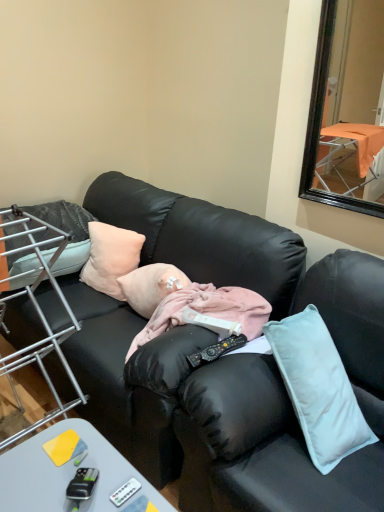
What is the approximate width of soft pink pillow at left, arranged as the first pillow when viewed from the left?

soft pink pillow at left, arranged as the first pillow when viewed from the left, is 55.47 centimeters in width.

What do you see at coordinates (67, 232) in the screenshot?
I see `soft pink pillow at left, arranged as the first pillow when viewed from the left` at bounding box center [67, 232].

This screenshot has height=512, width=384. In order to click on pink fabric at center, the first person when ordered from back to front in this screenshot , I will do (x=151, y=286).

What do you see at coordinates (216, 350) in the screenshot?
I see `black plastic remote control at center, marked as the 2th remote control in a left-to-right arrangement` at bounding box center [216, 350].

Find the location of a particular element. The width and height of the screenshot is (384, 512). white plastic remote control at lower center, the 1th remote control when ordered from bottom to top is located at coordinates (125, 492).

Identify the location of peach fabric pillow at center, which appears as the 2th pillow when viewed from the left. Image resolution: width=384 pixels, height=512 pixels. (111, 257).

This screenshot has height=512, width=384. I want to click on black leather couch at center, so click(x=226, y=359).

From a real-world perspective, does peach fabric pillow at center, which appears as the 1th pillow when viewed from the right, sit lower than black leather couch at center?

No.

Is peach fabric pillow at center, which appears as the 1th pillow when viewed from the right, to the left of black leather couch at center from the viewer's perspective?

Indeed, peach fabric pillow at center, which appears as the 1th pillow when viewed from the right, is positioned on the left side of black leather couch at center.

Which is nearer, (93, 262) or (99, 408)?

Point (93, 262) is positioned farther from the camera compared to point (99, 408).

Is pink fabric at center, arranged as the second person when viewed from the front, positioned in front of pink fabric at center, arranged as the first person when viewed from the front?

No.

From the image's perspective, which one is positioned higher, pink fabric at center, the first person when ordered from back to front, or pink fabric at center, arranged as the first person when viewed from the front?

pink fabric at center, the first person when ordered from back to front, from the image's perspective.

Looking at this image, who is smaller, pink fabric at center, the first person when ordered from back to front, or pink fabric at center, positioned as the 2th person in back-to-front order?

pink fabric at center, the first person when ordered from back to front, is smaller.

Is pink fabric at center, the first person when ordered from back to front, to the right of pink fabric at center, positioned as the 2th person in back-to-front order, from the viewer's perspective?

In fact, pink fabric at center, the first person when ordered from back to front, is to the left of pink fabric at center, positioned as the 2th person in back-to-front order.

Would you say pink fabric at center, arranged as the first person when viewed from the front, is inside or outside black leather couch at center?

pink fabric at center, arranged as the first person when viewed from the front, exists entirely within black leather couch at center.

You are a GUI agent. You are given a task and a screenshot of the screen. Output one action in this format:
    pyautogui.click(x=<x>, y=<y>)
    Task: Click on the studio couch in front of the pink fabric at center, arranged as the first person when viewed from the front
    The height and width of the screenshot is (512, 384).
    Given the screenshot: What is the action you would take?
    pyautogui.click(x=226, y=359)

Considering the relative sizes of pink fabric at center, positioned as the 2th person in back-to-front order, and black leather couch at center in the image provided, is pink fabric at center, positioned as the 2th person in back-to-front order, wider than black leather couch at center?

No.

From a real-world perspective, between pink fabric at center, arranged as the first person when viewed from the front, and black leather couch at center, who is vertically higher?

In real-world perspective, pink fabric at center, arranged as the first person when viewed from the front, is above.

From their relative heights in the image, would you say pink fabric at center, arranged as the second person when viewed from the front, is taller or shorter than peach fabric pillow at center, which appears as the 2th pillow when viewed from the left?

In the image, pink fabric at center, arranged as the second person when viewed from the front, appears to be shorter than peach fabric pillow at center, which appears as the 2th pillow when viewed from the left.

Is pink fabric at center, the first person when ordered from back to front, to the left or to the right of peach fabric pillow at center, which appears as the 1th pillow when viewed from the right, in the image?

Based on their positions, pink fabric at center, the first person when ordered from back to front, is located to the right of peach fabric pillow at center, which appears as the 1th pillow when viewed from the right.

Does pink fabric at center, the first person when ordered from back to front, turn towards peach fabric pillow at center, which appears as the 1th pillow when viewed from the right?

No, pink fabric at center, the first person when ordered from back to front, is not facing towards peach fabric pillow at center, which appears as the 1th pillow when viewed from the right.

Is pink fabric at center, arranged as the second person when viewed from the front, further to camera compared to peach fabric pillow at center, which appears as the 2th pillow when viewed from the left?

No.

Would you say soft pink pillow at left, arranged as the first pillow when viewed from the left, contains metal wire rack at left?

No, metal wire rack at left is not inside soft pink pillow at left, arranged as the first pillow when viewed from the left.

Is soft pink pillow at left, arranged as the first pillow when viewed from the left, to the right of metal wire rack at left from the viewer's perspective?

Incorrect, soft pink pillow at left, arranged as the first pillow when viewed from the left, is not on the right side of metal wire rack at left.

Considering the sizes of objects soft pink pillow at left, the 2th pillow from the right, and metal wire rack at left in the image provided, who is smaller, soft pink pillow at left, the 2th pillow from the right, or metal wire rack at left?

Smaller between the two is metal wire rack at left.

Is soft pink pillow at left, arranged as the first pillow when viewed from the left, aimed at metal wire rack at left?

No, soft pink pillow at left, arranged as the first pillow when viewed from the left, does not turn towards metal wire rack at left.

Measure the distance from soft pink pillow at left, the 2th pillow from the right, to black leather couch at center.

A distance of 22.02 inches exists between soft pink pillow at left, the 2th pillow from the right, and black leather couch at center.

From the image's perspective, who appears lower, soft pink pillow at left, the 2th pillow from the right, or black leather couch at center?

From the image's view, black leather couch at center is below.

Consider the image. From a real-world perspective, is soft pink pillow at left, arranged as the first pillow when viewed from the left, above or below black leather couch at center?

soft pink pillow at left, arranged as the first pillow when viewed from the left, is above black leather couch at center.

Is soft pink pillow at left, the 2th pillow from the right, bigger or smaller than black leather couch at center?

Considering their sizes, soft pink pillow at left, the 2th pillow from the right, takes up less space than black leather couch at center.

Does point (77, 241) appear closer or farther from the camera than point (132, 290)?

Clearly, point (77, 241) is more distant from the camera than point (132, 290).

From a real-world perspective, is soft pink pillow at left, the 2th pillow from the right, located beneath pink fabric at center, the first person when ordered from back to front?

Actually, soft pink pillow at left, the 2th pillow from the right, is physically above pink fabric at center, the first person when ordered from back to front, in the real world.

Can pink fabric at center, the first person when ordered from back to front, be found inside soft pink pillow at left, arranged as the first pillow when viewed from the left?

No.

Does soft pink pillow at left, the 2th pillow from the right, lie behind pink fabric at center, arranged as the second person when viewed from the front?

Yes, it is behind pink fabric at center, arranged as the second person when viewed from the front.

Locate an element on the screen. The height and width of the screenshot is (512, 384). studio couch that appears below the peach fabric pillow at center, which appears as the 2th pillow when viewed from the left (from a real-world perspective) is located at coordinates (226, 359).

Find the location of `person above the pink fabric at center, positioned as the 2th person in back-to-front order (from the image's perspective)`. person above the pink fabric at center, positioned as the 2th person in back-to-front order (from the image's perspective) is located at coordinates (151, 286).

Which object lies further to the anchor point peach fabric pillow at center, which appears as the 1th pillow when viewed from the right, pink fabric at center, arranged as the first person when viewed from the front, or metal wire rack at left?

metal wire rack at left.

Based on their spatial positions, is pink fabric at center, positioned as the 2th person in back-to-front order, or metal wire rack at left further from soft pink pillow at left, the 2th pillow from the right?

pink fabric at center, positioned as the 2th person in back-to-front order.

From the image, which object appears to be farther from white plastic remote control at lower center, the 1th remote control from the left, metal wire rack at left or peach fabric pillow at center, which appears as the 1th pillow when viewed from the right?

Among the two, peach fabric pillow at center, which appears as the 1th pillow when viewed from the right, is located further to white plastic remote control at lower center, the 1th remote control from the left.

From the image, which object appears to be nearer to black plastic remote control at center, which is the first remote control from right to left, pink fabric at center, the first person when ordered from back to front, or black leather couch at center?

black leather couch at center.

Considering their positions, is pink fabric at center, the first person when ordered from back to front, positioned closer to white plastic remote control at lower center, the second remote control positioned from the top, than metal wire rack at left?

pink fabric at center, the first person when ordered from back to front.

Which object lies further to the anchor point soft pink pillow at left, arranged as the first pillow when viewed from the left, black plastic remote control at center, the 1th remote control positioned from the back, or metal wire rack at left?

Among the two, black plastic remote control at center, the 1th remote control positioned from the back, is located further to soft pink pillow at left, arranged as the first pillow when viewed from the left.

Considering their positions, is pink fabric at center, arranged as the second person when viewed from the front, positioned further to pink fabric at center, positioned as the 2th person in back-to-front order, than soft pink pillow at left, the 2th pillow from the right?

soft pink pillow at left, the 2th pillow from the right, lies further to pink fabric at center, positioned as the 2th person in back-to-front order, than the other object.

Based on the photo, looking at the image, which one is located closer to black leather couch at center, gray plastic desk at lower left or metal wire rack at left?

The object closer to black leather couch at center is metal wire rack at left.

Where is `person between soft pink pillow at left, arranged as the first pillow when viewed from the left, and pink fabric at center, positioned as the 2th person in back-to-front order, in the horizontal direction`? This screenshot has height=512, width=384. person between soft pink pillow at left, arranged as the first pillow when viewed from the left, and pink fabric at center, positioned as the 2th person in back-to-front order, in the horizontal direction is located at coordinates (151, 286).

At what (x,y) coordinates should I click in order to perform the action: click on remote control between black leather couch at center and peach fabric pillow at center, which appears as the 2th pillow when viewed from the left, along the z-axis. Please return your answer as a coordinate pair (x, y). The image size is (384, 512). Looking at the image, I should click on (216, 350).

Image resolution: width=384 pixels, height=512 pixels. Identify the location of remote control between pink fabric at center, positioned as the 2th person in back-to-front order, and peach fabric pillow at center, which appears as the 1th pillow when viewed from the right, in the front-back direction. (216, 350).

I want to click on chair positioned between gray plastic desk at lower left and soft pink pillow at left, arranged as the first pillow when viewed from the left, from near to far, so click(36, 308).